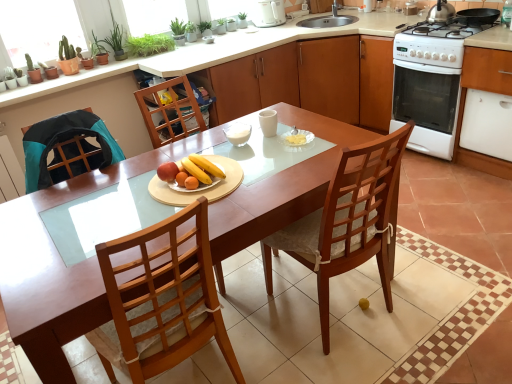
Question: In terms of size, does wooden cabinet at center, the 2th cabinetry from the front, appear bigger or smaller than stainless steel kettle at upper right?

Choices:
 (A) big
 (B) small

Answer: (A)

Question: From the image's perspective, is wooden cabinet at center, the 2th cabinetry from the front, above or below stainless steel kettle at upper right?

Choices:
 (A) below
 (B) above

Answer: (A)

Question: Estimate the real-world distances between objects in this image. Which object is closer to the white glossy oven at right?

Choices:
 (A) white glossy gas stove at right
 (B) yellow matte bananas at center, the second fruit dish viewed from the left
 (C) wooden table at center
 (D) white glossy oven at right, which ranks as the second cabinetry in left-to-right order
 (E) stainless steel kettle at upper right

Answer: (D)

Question: Which of these objects is positioned farthest from the wooden table at center?

Choices:
 (A) wooden cabinet at center, the second cabinetry in the right-to-left sequence
 (B) smooth wooden plate with fruits at center, which ranks as the 1th fruit dish in left-to-right order
 (C) wooden chair at center
 (D) green leafy plant at upper left
 (E) white glossy oven at right, which is the first cabinetry in right-to-left order

Answer: (D)